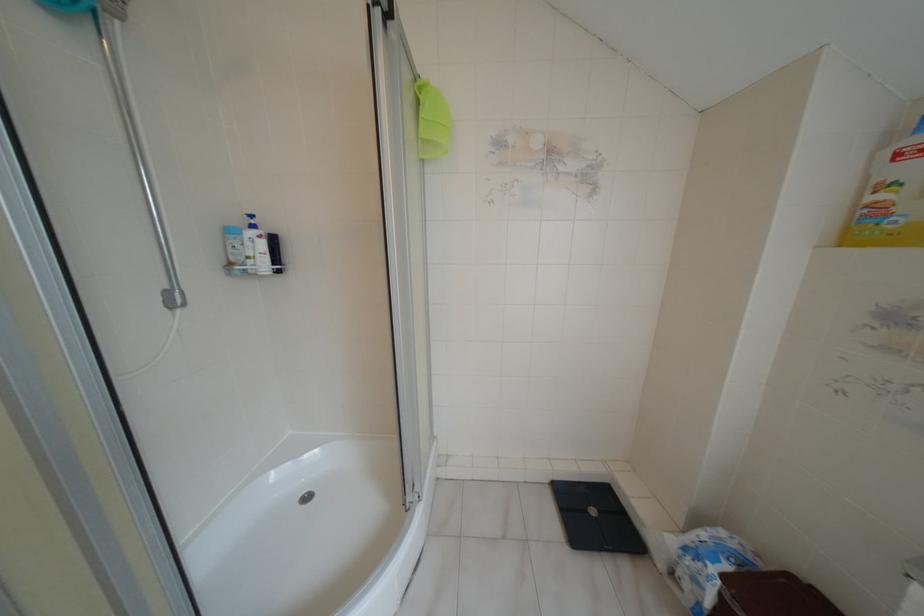
I want to click on shower door handle, so click(137, 146).